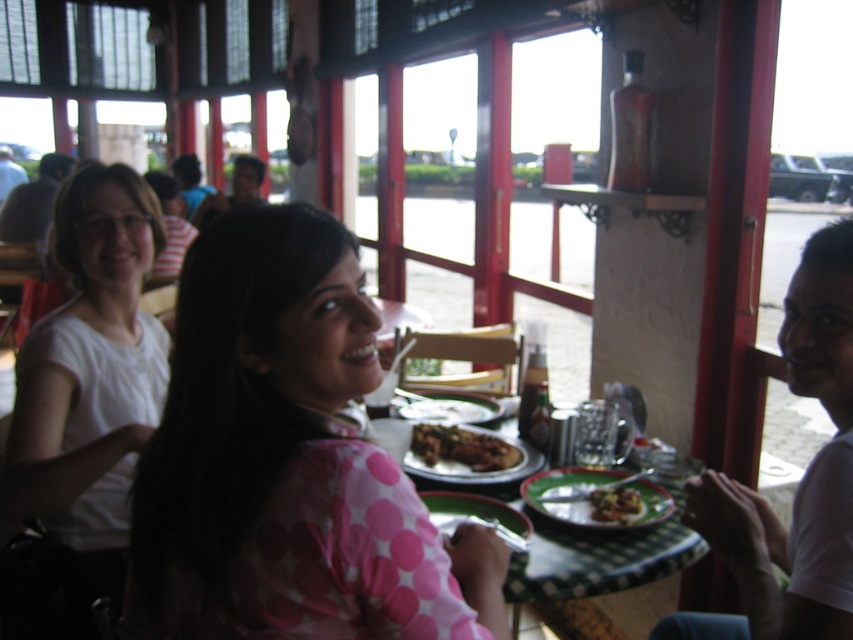
Is point (393, 513) closer to viewer compared to point (660, 506)?

Yes.

Which is in front, point (335, 545) or point (670, 497)?

Positioned in front is point (335, 545).

Where is `pink dotted shirt at center`? The width and height of the screenshot is (853, 640). pink dotted shirt at center is located at coordinates point(283,451).

Who is positioned more to the right, pink dotted shirt at center or matte white shirt at upper left?

pink dotted shirt at center is more to the right.

Who is positioned more to the left, pink dotted shirt at center or matte white shirt at upper left?

From the viewer's perspective, matte white shirt at upper left appears more on the left side.

Locate an element on the screen. pink dotted shirt at center is located at coordinates (283, 451).

Which is more to the right, white matte shirt at right or brown crispy bread at center?

Positioned to the right is white matte shirt at right.

Is white matte shirt at right closer to the viewer compared to brown crispy bread at center?

Yes, white matte shirt at right is in front of brown crispy bread at center.

The width and height of the screenshot is (853, 640). Describe the element at coordinates (798, 484) in the screenshot. I see `white matte shirt at right` at that location.

The image size is (853, 640). Identify the location of white matte shirt at right. (798, 484).